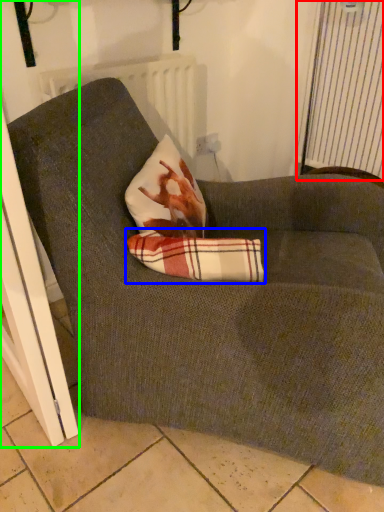
Question: Considering the real-world distances, which object is closest to curtain (highlighted by a red box)? plaid (highlighted by a blue box) or screen door (highlighted by a green box).

Choices:
 (A) plaid
 (B) screen door

Answer: (A)